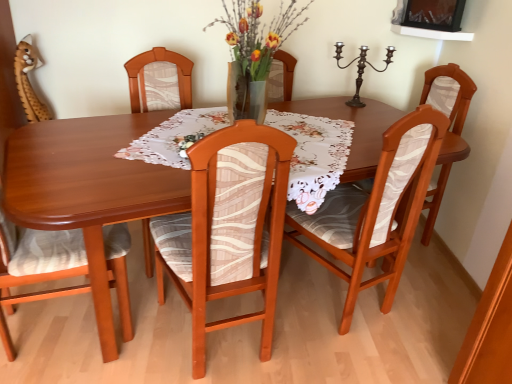
The height and width of the screenshot is (384, 512). I want to click on unoccupied region to the right of wooden chair at center, which is the fourth chair from left to right, so tap(426, 307).